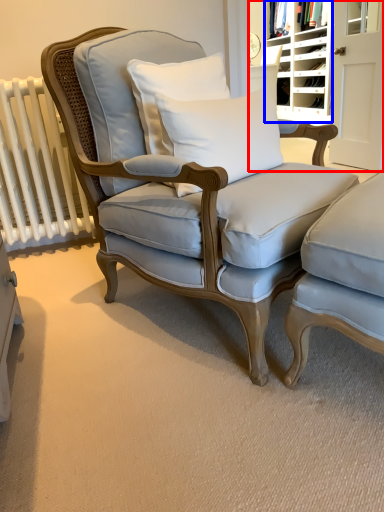
Question: Which object is closer to the camera taking this photo, bookshelf (highlighted by a red box) or shelf (highlighted by a blue box)?

Choices:
 (A) bookshelf
 (B) shelf

Answer: (A)